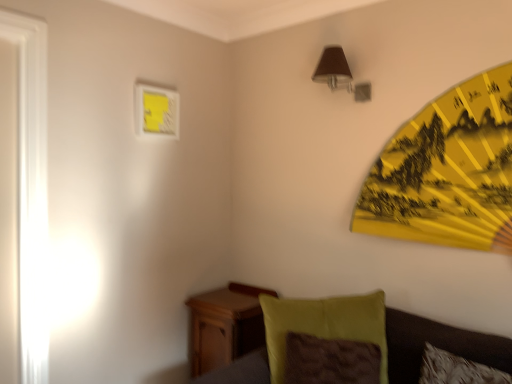
What do you see at coordinates (447, 171) in the screenshot? I see `yellow paper umbrella at upper right` at bounding box center [447, 171].

Where is `wooden nightstand at lower left`? Image resolution: width=512 pixels, height=384 pixels. wooden nightstand at lower left is located at coordinates (225, 325).

The image size is (512, 384). Find the location of `velvety green pillow at lower right`. velvety green pillow at lower right is located at coordinates (323, 322).

Do you think brown fabric lampshade at upper right is within velvet green couch at lower right, or outside of it?

brown fabric lampshade at upper right is spatially situated outside velvet green couch at lower right.

Is brown fabric lampshade at upper right taller than velvet green couch at lower right?

No.

From a real-world perspective, does brown fabric lampshade at upper right stand above velvet green couch at lower right?

Yes, from a real-world perspective, brown fabric lampshade at upper right is over velvet green couch at lower right

From the image's perspective, who appears lower, brown fabric lampshade at upper right or velvet green couch at lower right?

velvet green couch at lower right appears lower in the image.

From a real-world perspective, does wooden nightstand at lower left sit lower than velvet green couch at lower right?

Yes, from a real-world perspective, wooden nightstand at lower left is under velvet green couch at lower right.

In terms of size, does wooden nightstand at lower left appear bigger or smaller than velvet green couch at lower right?

Considering their sizes, wooden nightstand at lower left takes up less space than velvet green couch at lower right.

Is wooden nightstand at lower left not near velvet green couch at lower right?

No.

Is matte yellow picture frame at upper left shorter than yellow paper umbrella at upper right?

Yes, matte yellow picture frame at upper left is shorter than yellow paper umbrella at upper right.

How distant is matte yellow picture frame at upper left from yellow paper umbrella at upper right?

matte yellow picture frame at upper left is 4.43 feet from yellow paper umbrella at upper right.

Is yellow paper umbrella at upper right surrounded by matte yellow picture frame at upper left?

No, yellow paper umbrella at upper right is not inside matte yellow picture frame at upper left.

Which of these two, matte yellow picture frame at upper left or yellow paper umbrella at upper right, is smaller?

matte yellow picture frame at upper left is smaller.

Considering the relative positions of velvet green couch at lower right and wooden nightstand at lower left in the image provided, is velvet green couch at lower right to the left of wooden nightstand at lower left from the viewer's perspective?

In fact, velvet green couch at lower right is to the right of wooden nightstand at lower left.

Consider the image. Which of these two, velvet green couch at lower right or wooden nightstand at lower left, is wider?

Wider between the two is velvet green couch at lower right.

Can you see velvet green couch at lower right touching wooden nightstand at lower left?

Yes, velvet green couch at lower right and wooden nightstand at lower left clearly make contact.

Is wooden nightstand at lower left at the back of velvety green pillow at lower right?

Yes, velvety green pillow at lower right is facing away from wooden nightstand at lower left.

Which is nearer, (365, 317) or (219, 300)?

Point (365, 317).

Is velvety green pillow at lower right inside or outside of wooden nightstand at lower left?

velvety green pillow at lower right is outside wooden nightstand at lower left.

Which object is positioned more to the right, velvety green pillow at lower right or wooden nightstand at lower left?

velvety green pillow at lower right is more to the right.

In order to click on table lamp lying on the right of velvety green pillow at lower right in this screenshot , I will do `click(339, 74)`.

Which object is further away from the camera taking this photo, velvety green pillow at lower right or brown fabric lampshade at upper right?

Positioned behind is brown fabric lampshade at upper right.

What's the angular difference between velvety green pillow at lower right and brown fabric lampshade at upper right's facing directions?

The angular difference between velvety green pillow at lower right and brown fabric lampshade at upper right is 41 degrees.

Which point is more forward, (296, 329) or (324, 79)?

The point (296, 329) is closer to the camera.

This screenshot has width=512, height=384. What are the coordinates of `umbrella lying above the velvety green pillow at lower right (from the image's perspective)` in the screenshot? It's located at (447, 171).

From the picture: Is velvety green pillow at lower right looking in the opposite direction of yellow paper umbrella at upper right?

No, velvety green pillow at lower right's orientation is not away from yellow paper umbrella at upper right.

Between velvety green pillow at lower right and yellow paper umbrella at upper right, which one has smaller width?

yellow paper umbrella at upper right.

Does velvety green pillow at lower right appear on the right side of yellow paper umbrella at upper right?

No, velvety green pillow at lower right is not to the right of yellow paper umbrella at upper right.

This screenshot has width=512, height=384. I want to click on table lamp above the velvet green couch at lower right (from a real-world perspective), so click(x=339, y=74).

Identify the location of nightstand below the velvet green couch at lower right (from the image's perspective). Image resolution: width=512 pixels, height=384 pixels. (225, 325).

Considering their positions, is velvet green couch at lower right positioned closer to velvety green pillow at lower right than matte yellow picture frame at upper left?

velvet green couch at lower right.

From the image, which object appears to be farther from yellow paper umbrella at upper right, brown fabric lampshade at upper right or wooden nightstand at lower left?

Among the two, wooden nightstand at lower left is located further to yellow paper umbrella at upper right.

Looking at the image, which one is located further to matte yellow picture frame at upper left, yellow paper umbrella at upper right or velvety green pillow at lower right?

yellow paper umbrella at upper right.

Which object lies further to the anchor point matte yellow picture frame at upper left, wooden nightstand at lower left or brown fabric lampshade at upper right?

Among the two, wooden nightstand at lower left is located further to matte yellow picture frame at upper left.

Estimate the real-world distances between objects in this image. Which object is closer to matte yellow picture frame at upper left, brown fabric lampshade at upper right or yellow paper umbrella at upper right?

brown fabric lampshade at upper right is positioned closer to the anchor matte yellow picture frame at upper left.

Considering their positions, is velvety green pillow at lower right positioned further to matte yellow picture frame at upper left than wooden nightstand at lower left?

velvety green pillow at lower right.

Looking at the image, which one is located closer to wooden nightstand at lower left, velvet green couch at lower right or velvety green pillow at lower right?

velvet green couch at lower right lies closer to wooden nightstand at lower left than the other object.

Considering their positions, is wooden nightstand at lower left positioned further to matte yellow picture frame at upper left than velvety green pillow at lower right?

velvety green pillow at lower right lies further to matte yellow picture frame at upper left than the other object.

Locate an element on the screen. The height and width of the screenshot is (384, 512). pillow between matte yellow picture frame at upper left and yellow paper umbrella at upper right from left to right is located at coordinates (323, 322).

The height and width of the screenshot is (384, 512). Identify the location of umbrella that lies between brown fabric lampshade at upper right and velvety green pillow at lower right from top to bottom. (447, 171).

Locate an element on the screen. Image resolution: width=512 pixels, height=384 pixels. couch situated between matte yellow picture frame at upper left and yellow paper umbrella at upper right from left to right is located at coordinates (437, 345).

I want to click on nightstand between velvet green couch at lower right and matte yellow picture frame at upper left along the z-axis, so click(x=225, y=325).